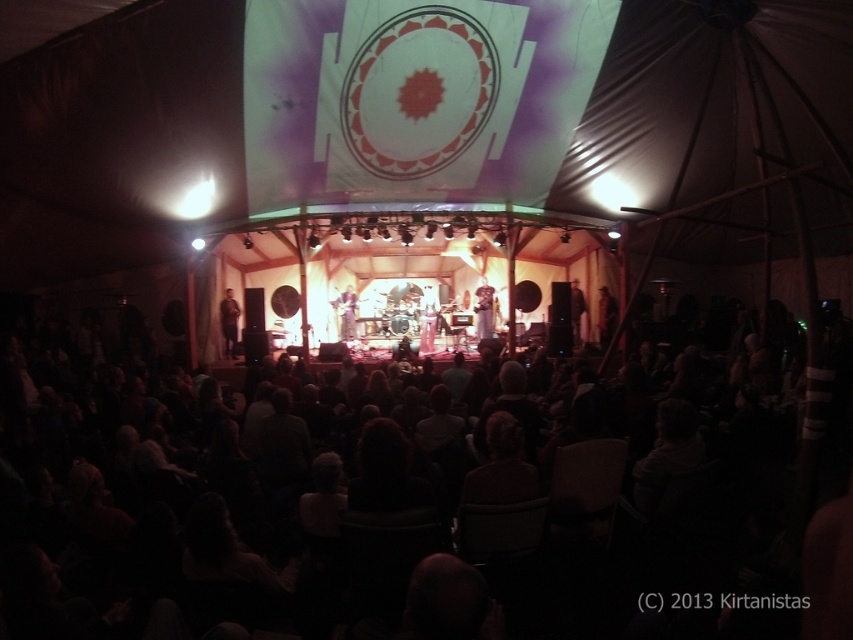
Question: Which of the following is the farthest from the observer?

Choices:
 (A) silky white dress at center
 (B) dark fabric chairs at center
 (C) matte black guitar at left

Answer: (A)

Question: Which of these objects is positioned farthest from the matte black guitar at left?

Choices:
 (A) dark fabric chairs at center
 (B) silky white dress at center

Answer: (A)

Question: Is matte black guitar at left further to camera compared to silky white dress at center?

Choices:
 (A) yes
 (B) no

Answer: (B)

Question: Is dark fabric chairs at center bigger than matte black guitar at left?

Choices:
 (A) yes
 (B) no

Answer: (A)

Question: Does dark fabric chairs at center have a larger size compared to matte black guitar at left?

Choices:
 (A) no
 (B) yes

Answer: (B)

Question: Among these points, which one is nearest to the camera?

Choices:
 (A) (347, 314)
 (B) (274, 422)
 (C) (229, 323)

Answer: (B)